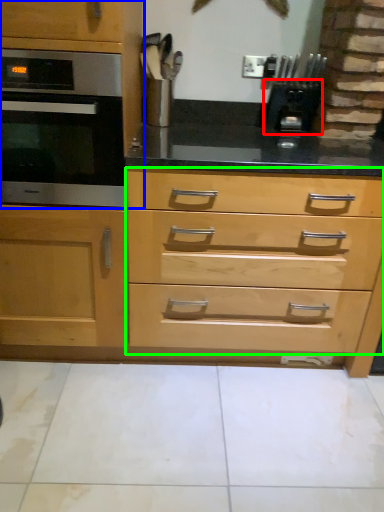
Question: Which object is positioned farthest from appliance (highlighted by a red box)? Select from cabinetry (highlighted by a blue box) and drawer (highlighted by a green box).

Choices:
 (A) cabinetry
 (B) drawer

Answer: (A)